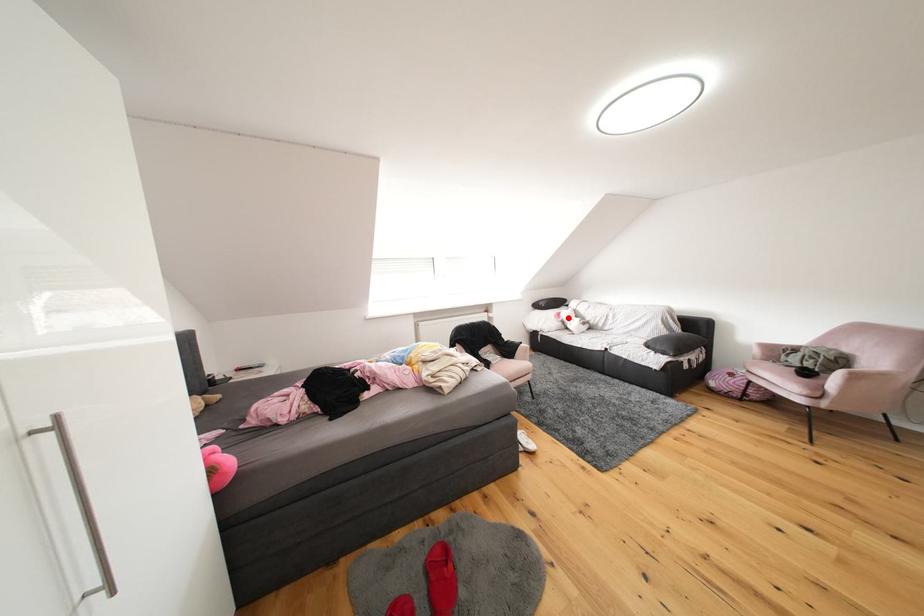
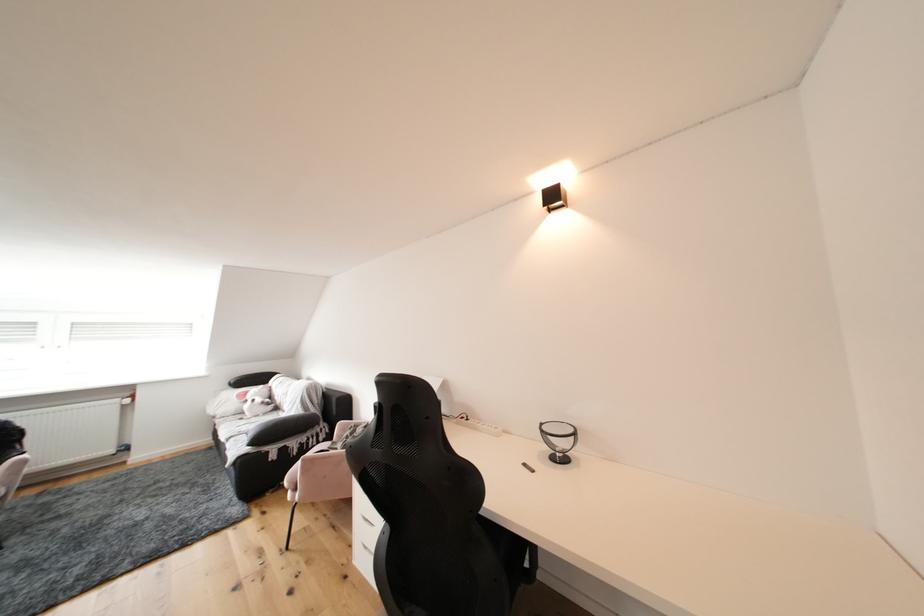
Question: A red point is marked in image1. In image2, is the corresponding 3D point closer to the camera or farther? Reply with the corresponding letter.

Choices:
 (A) The corresponding 3D point is closer.
 (B) The corresponding 3D point is farther.

Answer: (B)